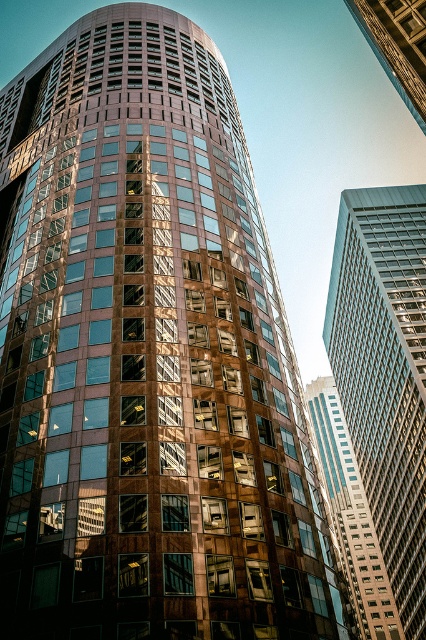
Question: Which of these objects is positioned closest to the metallic glass skyscraper at upper right?

Choices:
 (A) glassy reflective skyscraper at right
 (B) glossy glass skyscraper at center-right

Answer: (A)

Question: In this image, where is glassy reflective skyscraper at right located relative to metallic glass skyscraper at upper right?

Choices:
 (A) right
 (B) left

Answer: (A)

Question: Which point is farther to the camera?

Choices:
 (A) metallic glass skyscraper at upper right
 (B) glossy glass skyscraper at center-right

Answer: (A)

Question: From the image, what is the correct spatial relationship of glassy reflective skyscraper at right in relation to metallic glass skyscraper at upper right?

Choices:
 (A) above
 (B) below

Answer: (B)

Question: Is glassy reflective skyscraper at right to the left of glossy glass skyscraper at center-right from the viewer's perspective?

Choices:
 (A) yes
 (B) no

Answer: (B)

Question: Which object is farther from the camera taking this photo?

Choices:
 (A) glassy reflective skyscraper at right
 (B) glossy glass skyscraper at center-right
 (C) metallic glass skyscraper at upper right

Answer: (A)